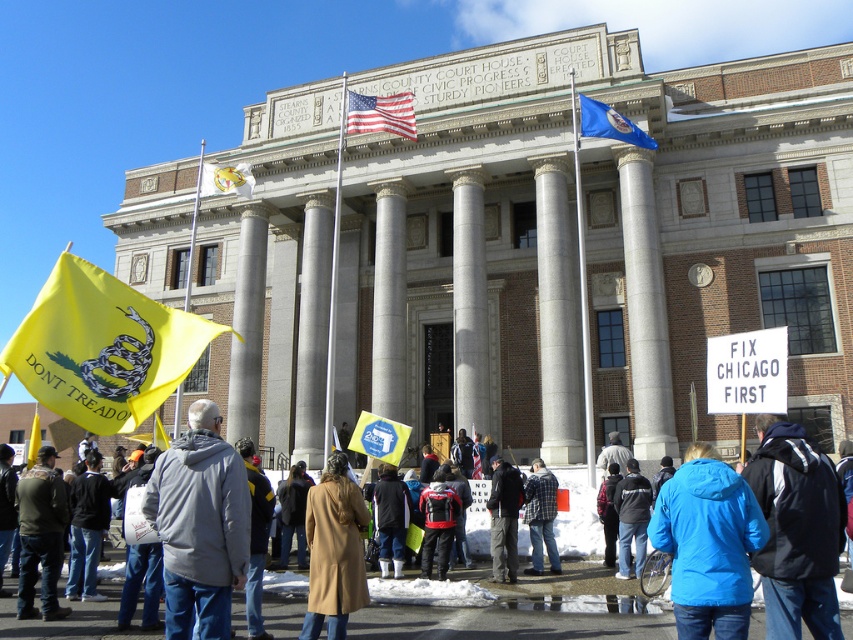
You are a photographer at the Stearnns County Court House and want to capture a photo that includes both the dark blue jacket at center and the yellow fabric flag at center. Which object should be placed to the left in the photo to ensure both are visible?

The yellow fabric flag at center should be placed to the left in the photo because the dark blue jacket at center is positioned on the right side of it, ensuring both are visible in the frame.

You are a photographer standing at the edge of the crowd. You want to take a photo that includes both the flannel shirt at center and the blue fabric flag at center. Given that your camera has a maximum focus range of 20 meters, will you be able to capture both objects in focus without moving your position?

The flannel shirt at center and blue fabric flag at center are 19.72 meters apart from each other. Since the distance between them is within the camera maximum focus range of 20 meters, you can capture both objects in focus without moving your position.